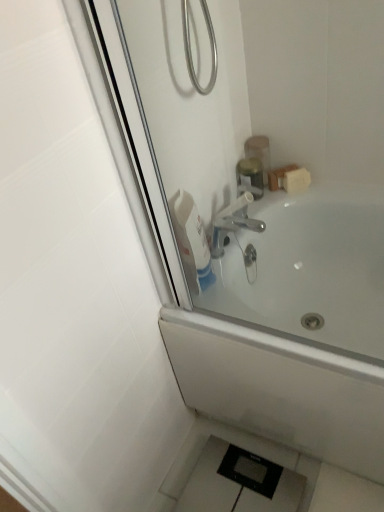
Where is `unoccupied area in front of white glossy bottle at upper center`? The height and width of the screenshot is (512, 384). unoccupied area in front of white glossy bottle at upper center is located at coordinates (219, 310).